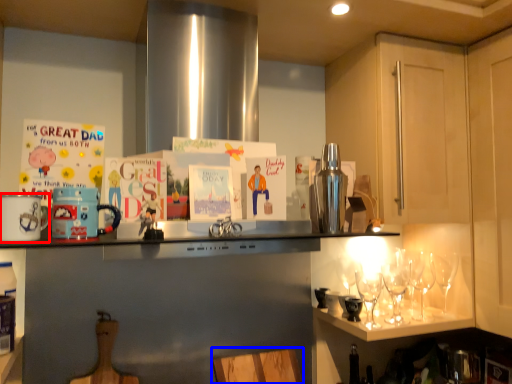
Question: Which of the following is the closest to the observer, appliance (highlighted by a red box) or chair (highlighted by a blue box)?

Choices:
 (A) appliance
 (B) chair

Answer: (A)